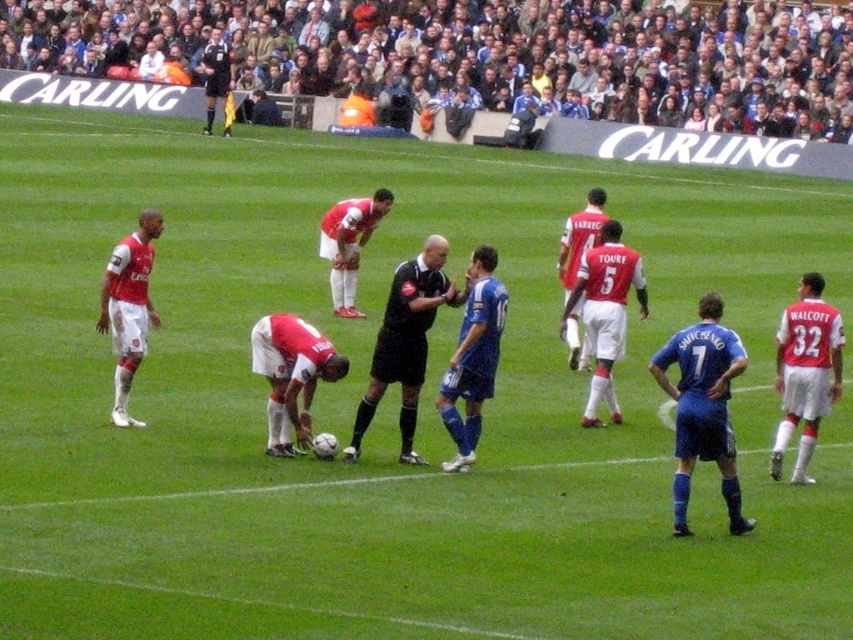
Can you confirm if matte red jersey at center is bigger than black matte referee at center?

Actually, matte red jersey at center might be smaller than black matte referee at center.

Does matte red jersey at center have a greater height compared to black matte referee at center?

No, matte red jersey at center is not taller than black matte referee at center.

Locate an element on the screen. The width and height of the screenshot is (853, 640). matte red jersey at center is located at coordinates (287, 412).

Can you confirm if white matte jersey at right is positioned above white matte soccer player at left?

Actually, white matte jersey at right is below white matte soccer player at left.

How much distance is there between white matte jersey at right and white matte soccer player at left?

white matte jersey at right and white matte soccer player at left are 5.08 meters apart from each other.

Between point (833, 397) and point (158, 227), which one is positioned in front?

Point (833, 397)

Locate an element on the screen. white matte jersey at right is located at coordinates (805, 372).

Does blue matte jersey at center appear on the right side of white matte jersey at right?

No, blue matte jersey at center is not to the right of white matte jersey at right.

Between point (730, 356) and point (791, 310), which one is positioned in front?

Point (730, 356) is more forward.

Is point (709, 323) more distant than point (801, 410)?

No, (709, 323) is closer to viewer.

Identify the location of blue matte jersey at center. (703, 406).